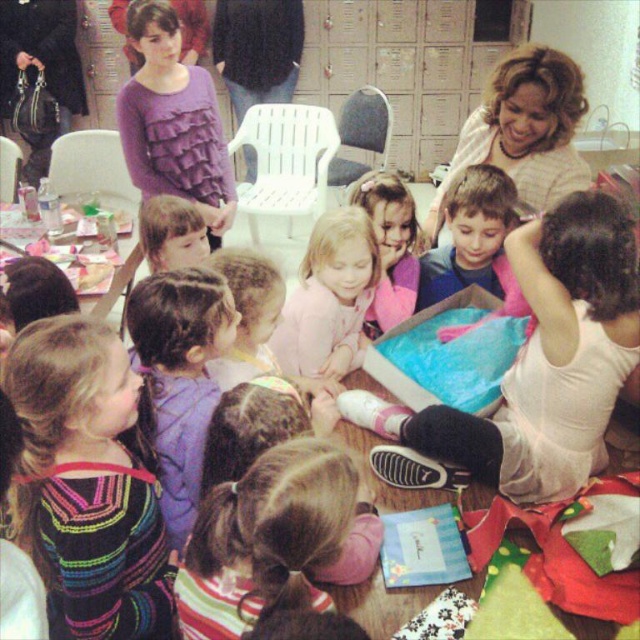
Between pink fabric at center and purple ruffled shirt at upper left, which one is positioned lower?

pink fabric at center is below.

Can you confirm if pink fabric at center is shorter than purple ruffled shirt at upper left?

Indeed, pink fabric at center has a lesser height compared to purple ruffled shirt at upper left.

This screenshot has width=640, height=640. In order to click on pink fabric at center in this screenshot , I will do `click(536, 365)`.

Is light purple sweater at center to the left of smooth pink sweater at center from the viewer's perspective?

Correct, you'll find light purple sweater at center to the left of smooth pink sweater at center.

Does light purple sweater at center have a smaller size compared to smooth pink sweater at center?

No.

The height and width of the screenshot is (640, 640). What do you see at coordinates (179, 376) in the screenshot?
I see `light purple sweater at center` at bounding box center [179, 376].

The height and width of the screenshot is (640, 640). I want to click on light purple sweater at center, so click(179, 376).

Is blonde hair at upper right below pink fabric dress at center?

No, blonde hair at upper right is not below pink fabric dress at center.

Is point (476, 154) positioned after point (355, 182)?

No.

You are a GUI agent. You are given a task and a screenshot of the screen. Output one action in this format:
    pyautogui.click(x=<x>, y=<y>)
    Task: Click on the blonde hair at upper right
    The height and width of the screenshot is (640, 640).
    Given the screenshot: What is the action you would take?
    pyautogui.click(x=524, y=129)